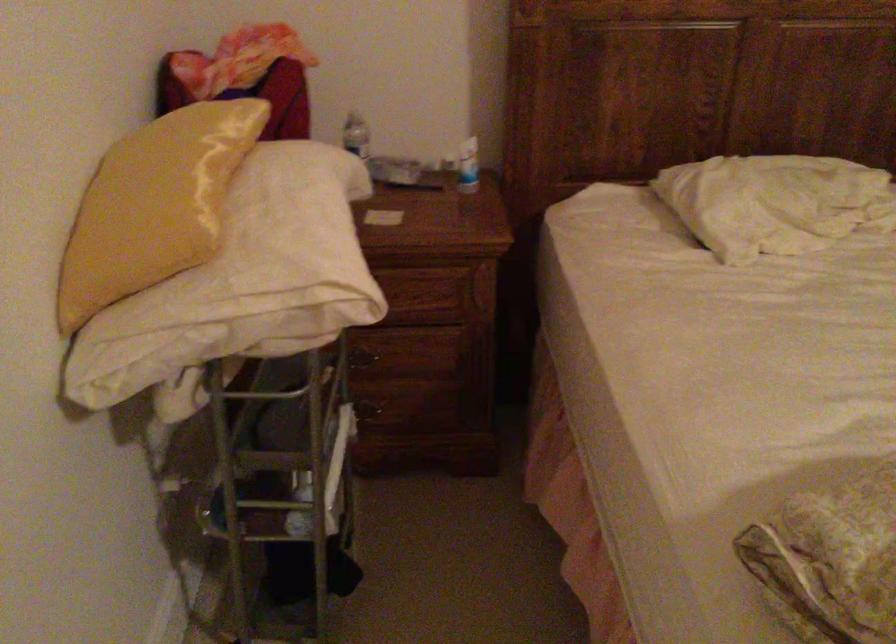
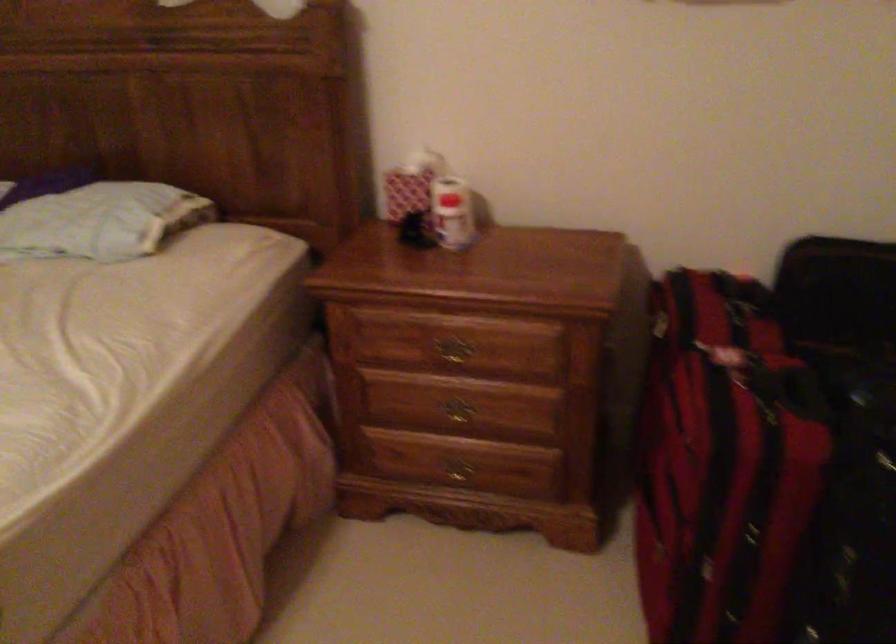
Question: In a continuous first-person perspective shot, in which direction is the camera moving?

Choices:
 (A) Left
 (B) Right
 (C) Forward
 (D) Backward

Answer: (B)